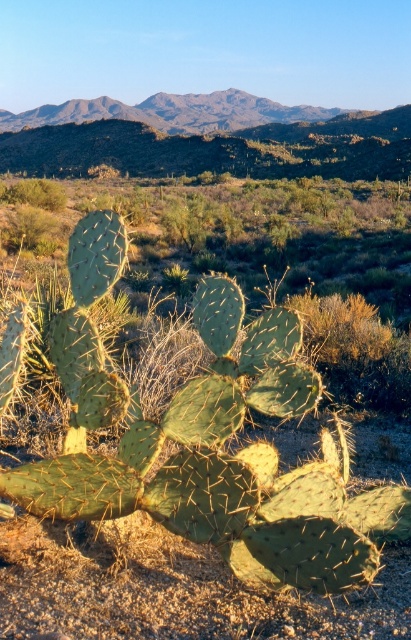
You are a hiker trying to navigate through the desert. You see the green spiny cactus at center and the rugged brown mountain at upper center. Which object is located to the right of the other?

The green spiny cactus at center is positioned on the right side of rugged brown mountain at upper center, so the cactus is to the right of the mountain.

In the scene shown: You are a photographer standing at a certain distance from the green spiny cactus at center. You want to take a closeup shot of the cactus without getting too close to avoid the spines. If your camera lens has a maximum zoom range of 10 feet, will you be able to capture a clear closeup?

The distance between you and the green spiny cactus at center is 11.01 feet. Since your camera lens can zoom up to 10 feet, you are 1.01 feet too far away to capture a clear closeup without moving closer.